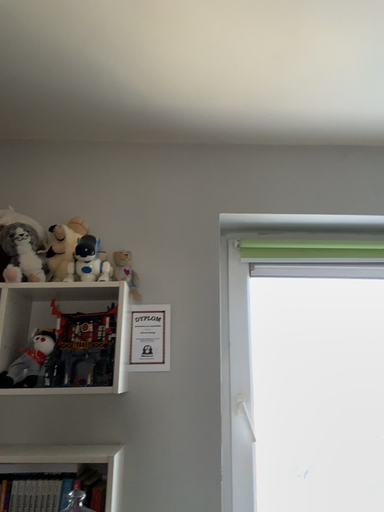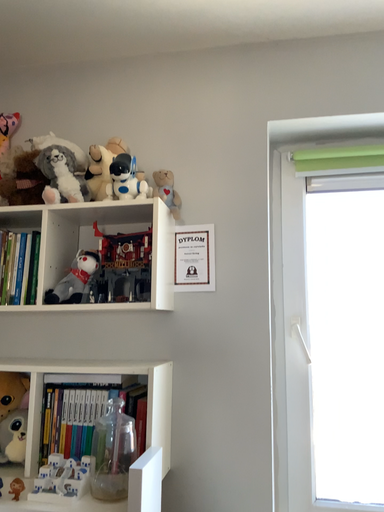
Question: Which way did the camera rotate in the video?

Choices:
 (A) rotated upward
 (B) rotated downward

Answer: (B)